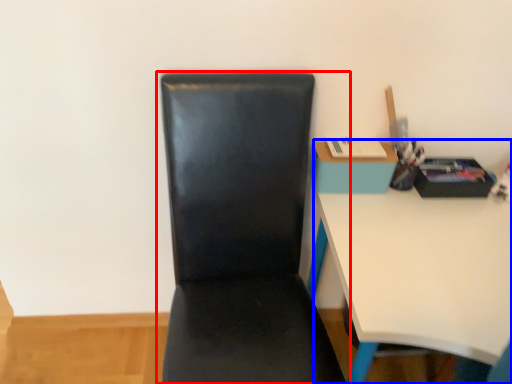
Question: Among these objects, which one is farthest to the camera, chair (highlighted by a red box) or desk (highlighted by a blue box)?

Choices:
 (A) chair
 (B) desk

Answer: (B)